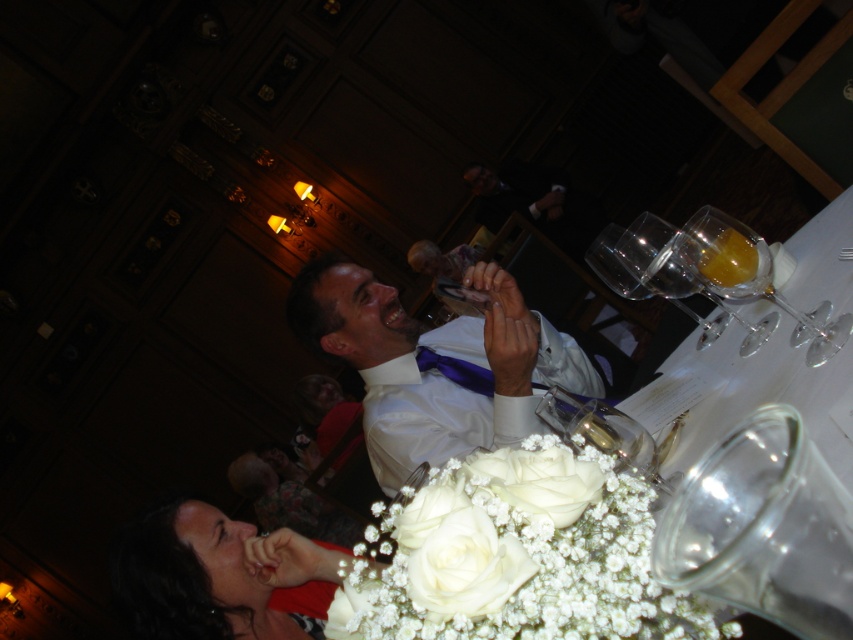
Between point (750, 248) and point (747, 276), which one is positioned behind?

Positioned behind is point (747, 276).

Who is more forward, (717,292) or (746,269)?

Point (746,269)

At what (x,y) coordinates should I click in order to perform the action: click on transparent glass wine glass at upper right. Please return your answer as a coordinate pair (x, y). The width and height of the screenshot is (853, 640). Looking at the image, I should click on [x=752, y=276].

Does white silk flowers at lower center have a larger size compared to smooth white dress at lower left?

No, white silk flowers at lower center is not bigger than smooth white dress at lower left.

At what (x,y) coordinates should I click in order to perform the action: click on white silk flowers at lower center. Please return your answer as a coordinate pair (x, y). This screenshot has width=853, height=640. Looking at the image, I should click on (517, 556).

Between point (355, 563) and point (254, 548), which one is positioned behind?

The point (254, 548) is more distant.

Identify the location of white silk flowers at lower center. This screenshot has height=640, width=853. (517, 556).

Does white satin shirt at center have a greater height compared to clear glass wine glass at center?

Yes, white satin shirt at center is taller than clear glass wine glass at center.

Is white satin shirt at center in front of clear glass wine glass at center?

No.

Where is `white satin shirt at center`? white satin shirt at center is located at coordinates (433, 369).

This screenshot has width=853, height=640. What are the coordinates of `white satin shirt at center` in the screenshot? It's located at (433, 369).